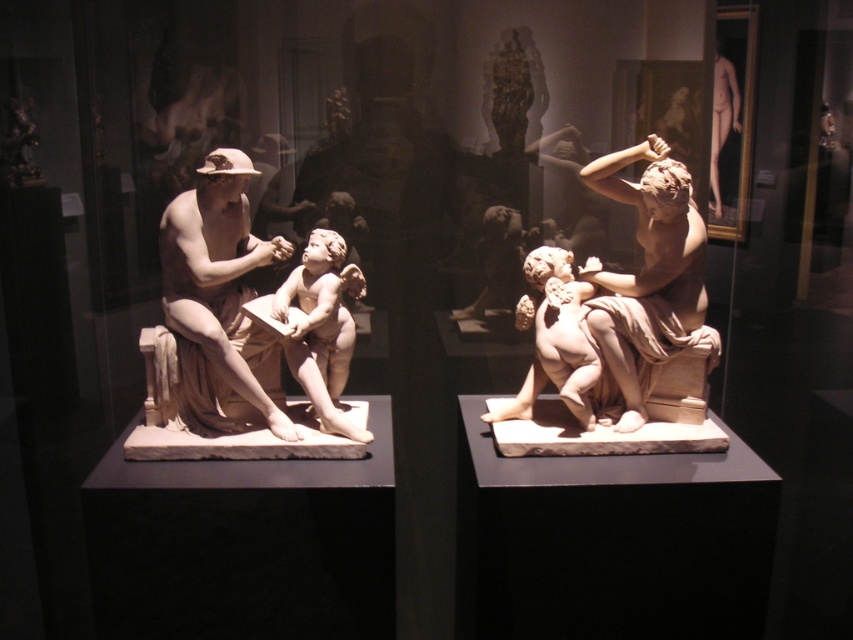
Question: Is matte stone man at left to the right of matte beige statue at right from the viewer's perspective?

Choices:
 (A) no
 (B) yes

Answer: (A)

Question: Which point appears closest to the camera in this image?

Choices:
 (A) (248, 342)
 (B) (614, 186)

Answer: (A)

Question: Is matte stone man at left wider than matte beige statue at right?

Choices:
 (A) no
 (B) yes

Answer: (B)

Question: Which object is farther from the camera taking this photo?

Choices:
 (A) matte beige statue at right
 (B) matte stone man at left

Answer: (B)

Question: Is matte stone man at left to the right of matte beige statue at right from the viewer's perspective?

Choices:
 (A) no
 (B) yes

Answer: (A)